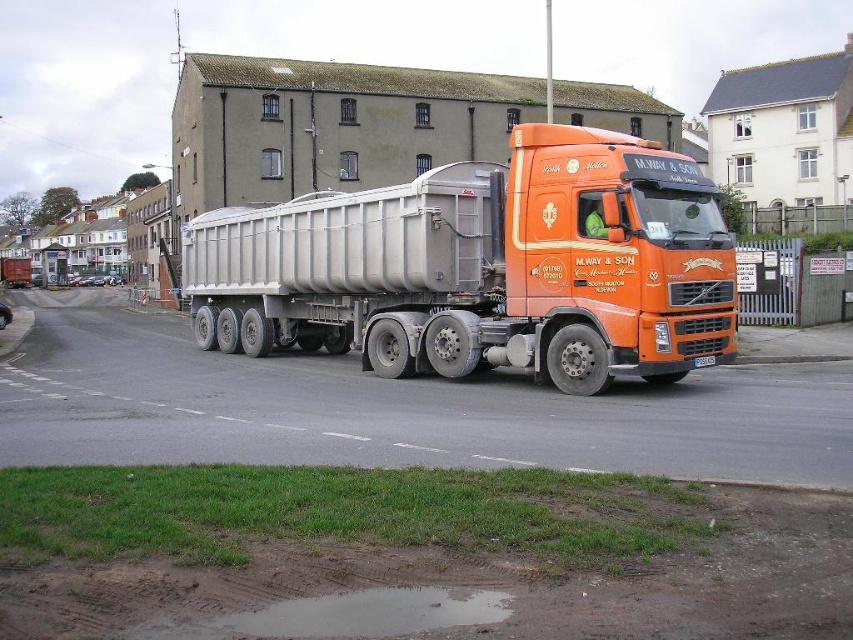
In the scene shown: You are a delivery driver who needs to park your orange matte truck at center in a narrow alley. The alley is only as wide as the muddy water at lower center. Will your truck fit in the alley?

The orange matte truck at center might be wider than muddy water at lower center, so there is a possibility that the truck will not fit in the alley.

You are a delivery driver who needs to park your vehicle at least 30 feet away from any water source to comply with safety regulations. You arrive at the location shown in the image and see the orange matte truck at center and the muddy water at lower center. Can you safely park your vehicle here?

The orange matte truck at center is 32.60 feet away from the muddy water at lower center, which meets the safety requirement of 30 feet. Therefore, parking here is safe as it complies with the regulations.

In the scene shown: You are a delivery driver who needs to park your orange matte truck at center in a specific spot. The parking spot is marked at coordinates point A. If the truck is currently at point B, which is at coordinates point B, which direction should you move the truck to reach the parking spot?

The orange matte truck at center is located at point B, so to reach the parking spot at point A, you should move the truck in the direction from point B to point A. However, without knowing the exact coordinates of point A, it is impossible to determine the specific direction required.